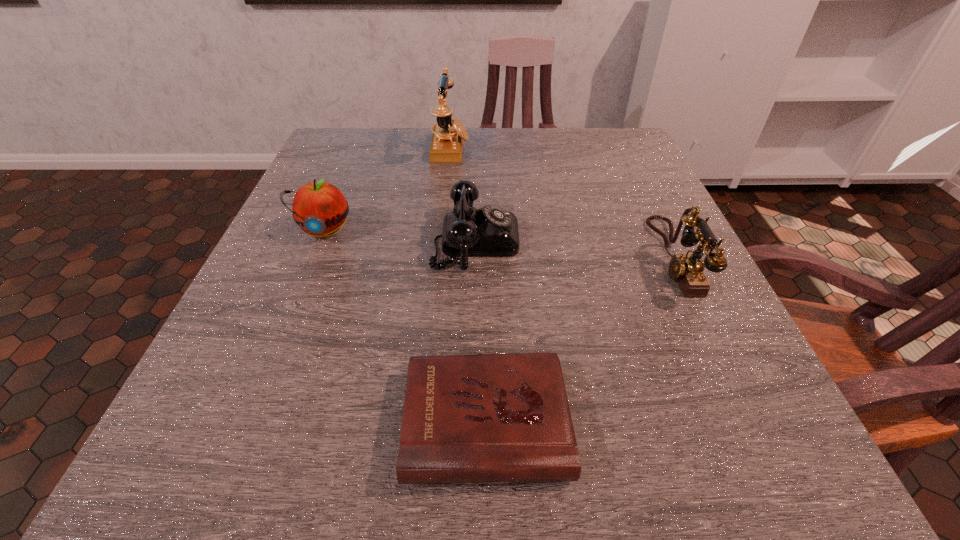
In the image, there is a desktop. What are the coordinates of `blank space at the near edge` in the screenshot? It's located at (350, 454).

You are a GUI agent. You are given a task and a screenshot of the screen. Output one action in this format:
    pyautogui.click(x=<x>, y=<y>)
    Task: Click on the vacant space at the left edge of the desktop
    
    Given the screenshot: What is the action you would take?
    pyautogui.click(x=283, y=310)

What are the coordinates of `free space at the right edge of the desktop` in the screenshot? It's located at (596, 203).

In the image, there is a desktop. Where is `vacant space at the far left corner`? vacant space at the far left corner is located at coordinates (345, 154).

Image resolution: width=960 pixels, height=540 pixels. In the image, there is a desktop. In order to click on free space at the far right corner in this screenshot , I will do `click(622, 176)`.

Image resolution: width=960 pixels, height=540 pixels. In order to click on vacant area between the shortest telephone and the apple in this screenshot , I will do `click(399, 235)`.

The width and height of the screenshot is (960, 540). Identify the location of empty space between the shortest telephone and the leftmost object. (399, 235).

Where is `vacant space that's between the rightmost object and the nearest object`? vacant space that's between the rightmost object and the nearest object is located at coordinates (579, 340).

This screenshot has height=540, width=960. Find the location of `free space between the shortest object and the apple`. free space between the shortest object and the apple is located at coordinates (405, 326).

Find the location of a particular element. free spot between the hardback book and the tallest object is located at coordinates (468, 286).